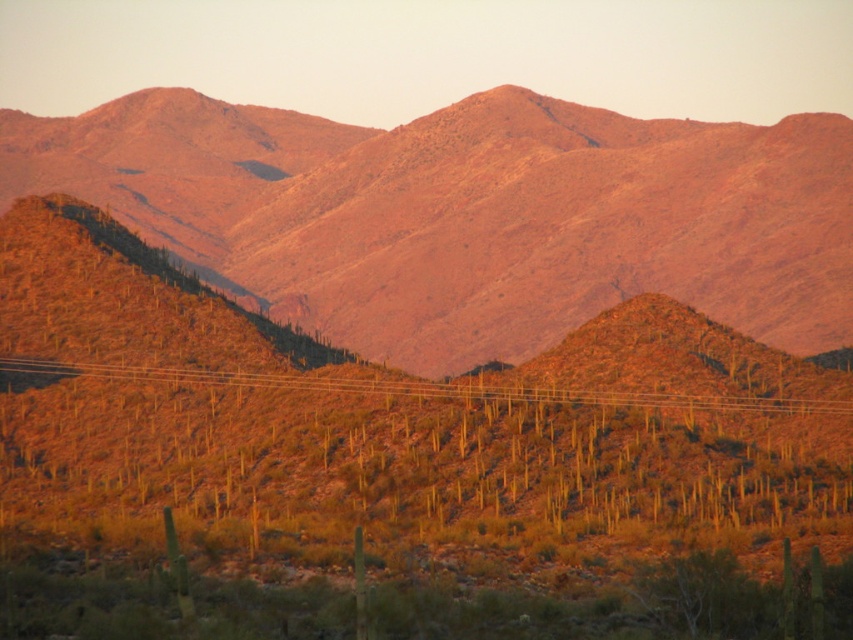
Question: Is desert sand at center positioned in front of metallic wire at center?

Choices:
 (A) yes
 (B) no

Answer: (B)

Question: Which point is closer to the camera?

Choices:
 (A) desert sand at center
 (B) metallic wire at center

Answer: (B)

Question: Among these objects, which one is nearest to the camera?

Choices:
 (A) desert sand at center
 (B) metallic wire at center

Answer: (B)

Question: Considering the relative positions of desert sand at center and metallic wire at center in the image provided, where is desert sand at center located with respect to metallic wire at center?

Choices:
 (A) below
 (B) above

Answer: (B)

Question: Can you confirm if desert sand at center is positioned to the left of metallic wire at center?

Choices:
 (A) yes
 (B) no

Answer: (B)